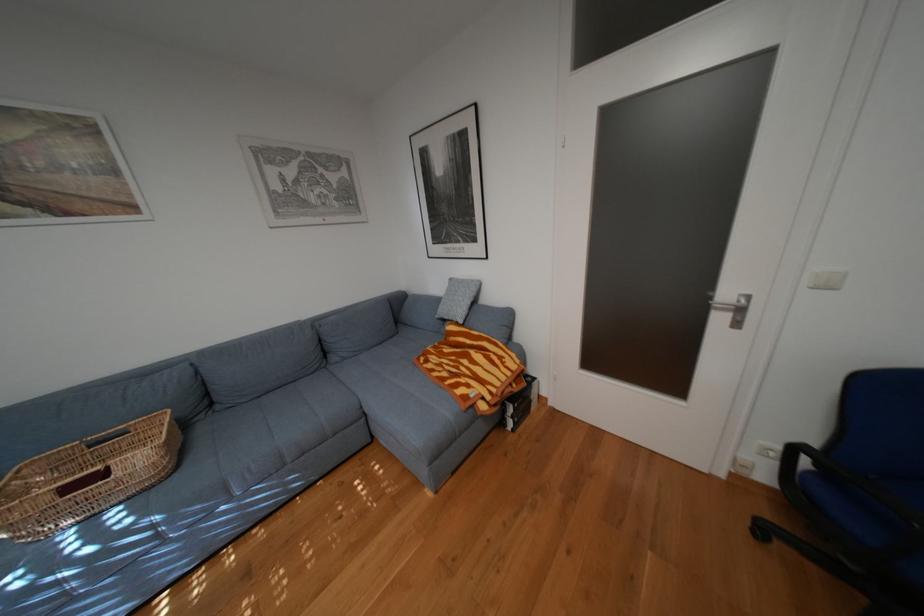
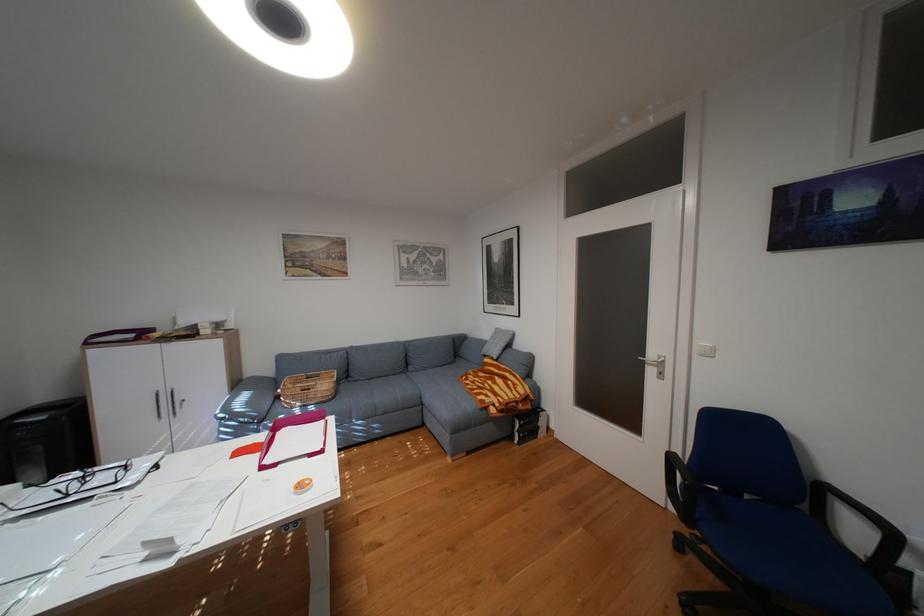
Find the pixel in the second image that matches (x=136, y=432) in the first image.

(331, 375)